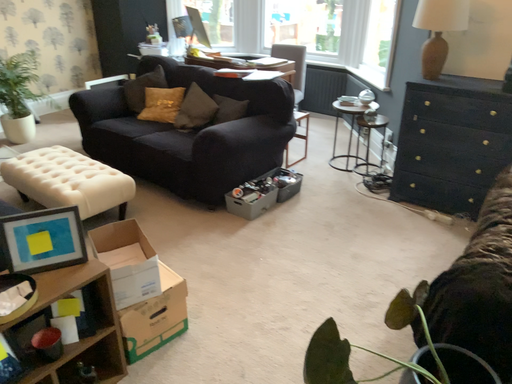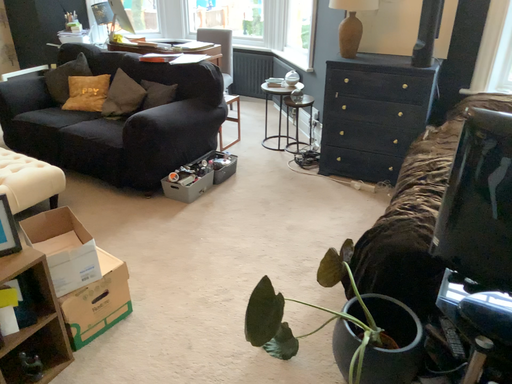
Question: Which way did the camera rotate in the video?

Choices:
 (A) rotated left
 (B) rotated right

Answer: (B)